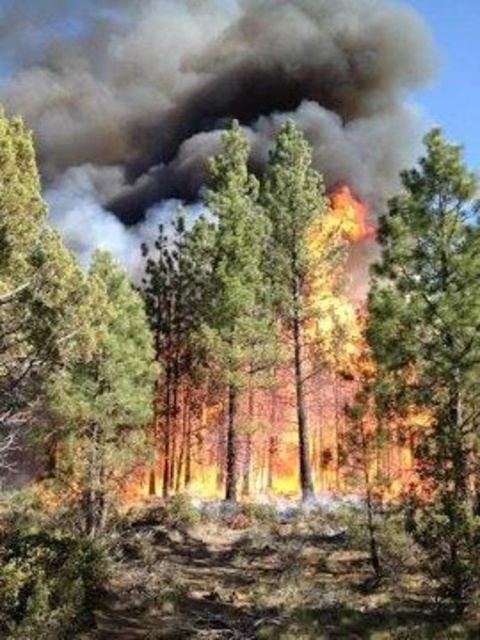
Is green textured pine tree at center bigger than charred wood tree trunk at center?

Indeed, green textured pine tree at center has a larger size compared to charred wood tree trunk at center.

Is green textured pine tree at center shorter than charred wood tree trunk at center?

No.

Locate an element on the screen. The height and width of the screenshot is (640, 480). green textured pine tree at center is located at coordinates (236, 282).

Image resolution: width=480 pixels, height=640 pixels. Describe the element at coordinates (434, 348) in the screenshot. I see `charred wood tree trunk at right` at that location.

Looking at this image, who is more forward, (474, 372) or (101, 465)?

Point (474, 372) is more forward.

Identify the location of charred wood tree trunk at right. (434, 348).

Is charred wood tree trunk at right smaller than green textured pine tree at center?

Indeed, charred wood tree trunk at right has a smaller size compared to green textured pine tree at center.

Between charred wood tree trunk at right and green textured pine tree at center, which one appears on the right side from the viewer's perspective?

From the viewer's perspective, charred wood tree trunk at right appears more on the right side.

This screenshot has height=640, width=480. What do you see at coordinates (434, 348) in the screenshot?
I see `charred wood tree trunk at right` at bounding box center [434, 348].

This screenshot has height=640, width=480. In order to click on charred wood tree trunk at right in this screenshot , I will do `click(434, 348)`.